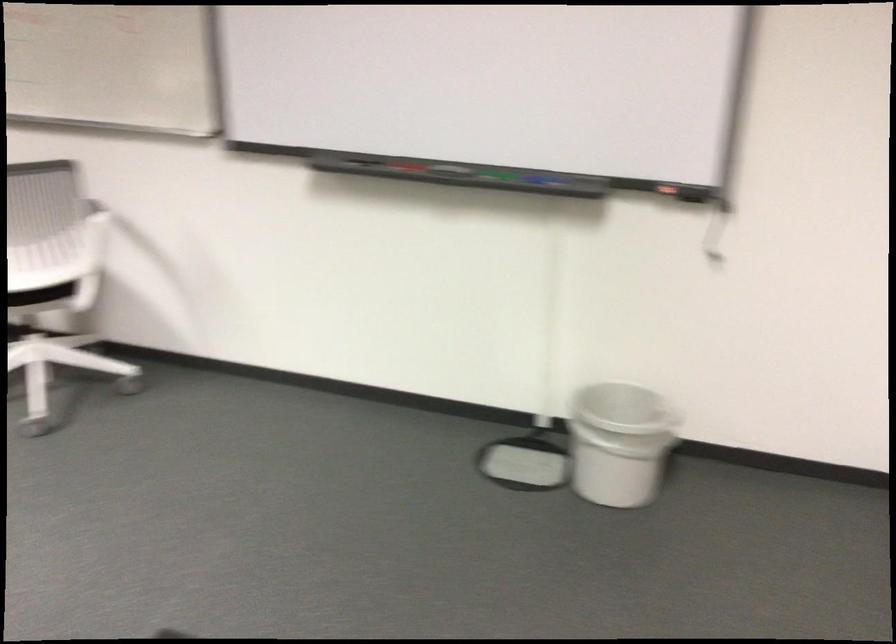
The height and width of the screenshot is (644, 896). Identify the location of white trash can. (618, 442).